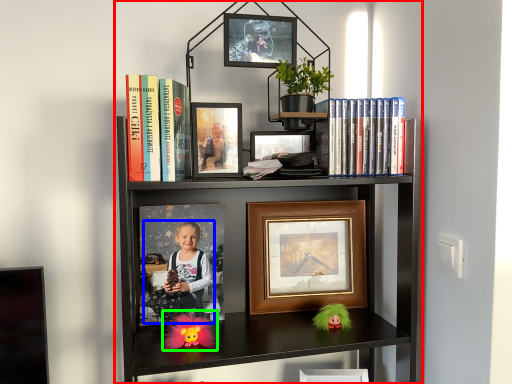
Question: Based on their relative distances, which object is farther from bookcase (highlighted by a red box)? Choose from person (highlighted by a blue box) and doll (highlighted by a green box).

Choices:
 (A) person
 (B) doll

Answer: (B)